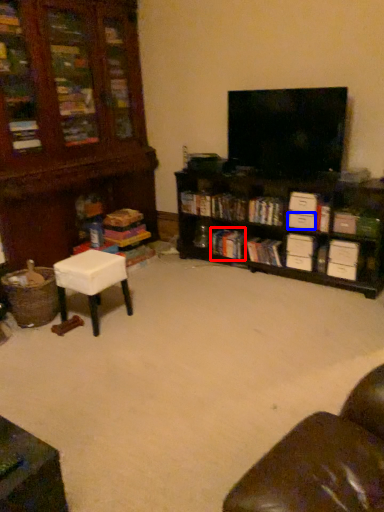
Question: Which point is closer to the camera, book (highlighted by a red box) or drawer (highlighted by a blue box)?

Choices:
 (A) book
 (B) drawer

Answer: (B)